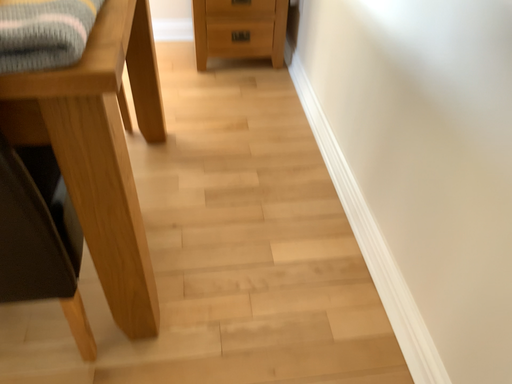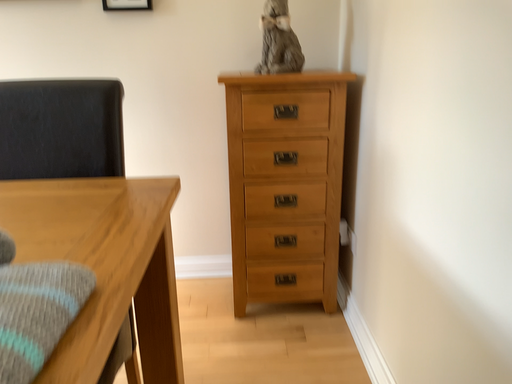
Question: How did the camera likely rotate when shooting the video?

Choices:
 (A) rotated upward
 (B) rotated downward

Answer: (A)